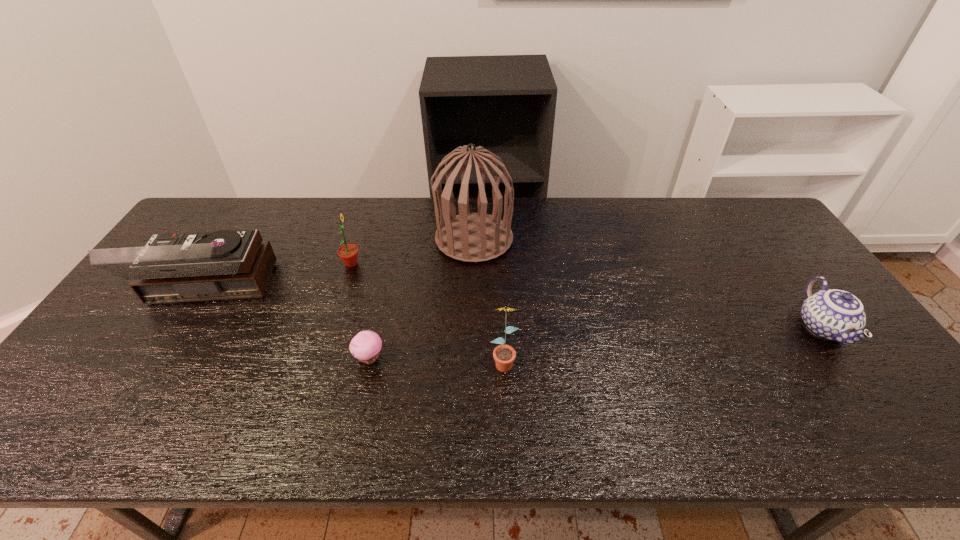
Find the location of `empty space that is in between the tallest object and the fifth object from right to left`. empty space that is in between the tallest object and the fifth object from right to left is located at coordinates (413, 251).

At what (x,y) coordinates should I click in order to perform the action: click on free space between the nearer sunflower and the leftmost object. Please return your answer as a coordinate pair (x, y). Looking at the image, I should click on point(356,326).

Where is `free spot between the nearer sunflower and the farther sunflower`? The width and height of the screenshot is (960, 540). free spot between the nearer sunflower and the farther sunflower is located at coordinates (427, 312).

Locate an element on the screen. free space between the fourth object from right to left and the rightmost object is located at coordinates (596, 343).

Locate an element on the screen. object identified as the fourth closest to the chinaware is located at coordinates (348, 253).

What are the coordinates of `the closest object to the nearer sunflower` in the screenshot? It's located at (365, 346).

You are a GUI agent. You are given a task and a screenshot of the screen. Output one action in this format:
    pyautogui.click(x=<x>, y=<y>)
    Task: Click on the vacant region that satisfies the following two spatial constraints: 1. on the face of the farther sunflower; 2. on the left side of the cupcake
    The image size is (960, 540).
    Given the screenshot: What is the action you would take?
    pyautogui.click(x=322, y=359)

Locate an element on the screen. This screenshot has height=540, width=960. free space in the image that satisfies the following two spatial constraints: 1. on the face of the left sunflower; 2. on the back side of the fourth object from right to left is located at coordinates (322, 359).

Locate an element on the screen. free space that satisfies the following two spatial constraints: 1. on the front side of the tallest object; 2. on the face of the left sunflower is located at coordinates (473, 264).